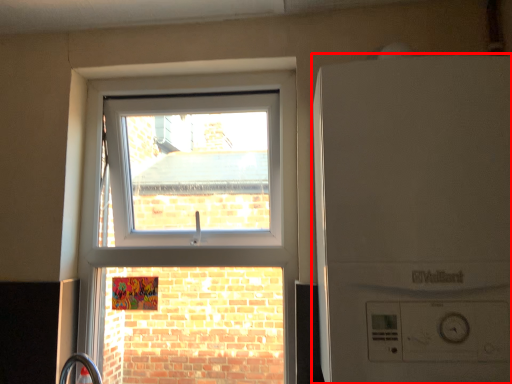
Question: From the image's perspective, where is washing machine (annotated by the red box) located relative to window?

Choices:
 (A) above
 (B) below

Answer: (A)